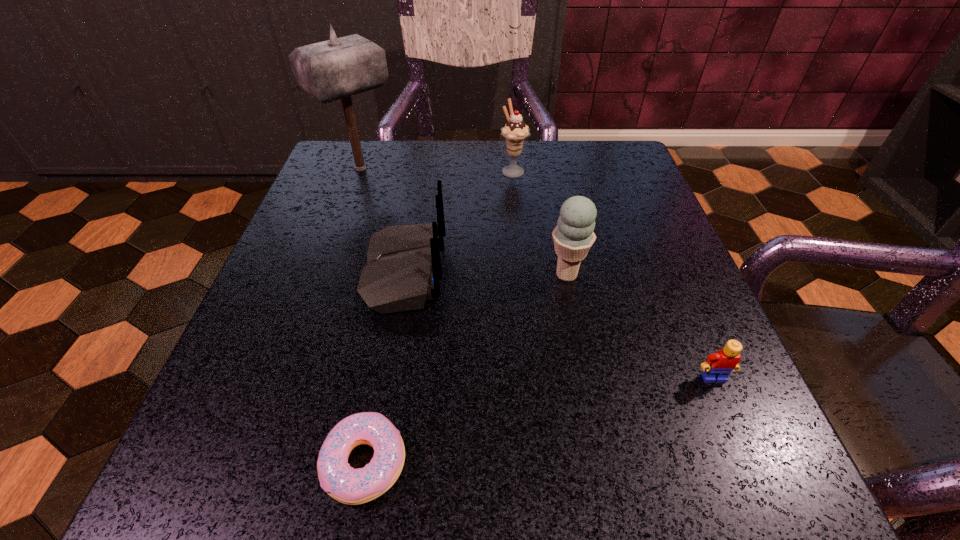
Where is `the tallest object`? This screenshot has height=540, width=960. the tallest object is located at coordinates (338, 68).

Where is `the farther ice cream`? This screenshot has width=960, height=540. the farther ice cream is located at coordinates (515, 132).

This screenshot has width=960, height=540. Identify the location of the left ice cream. (515, 132).

Where is `the right ice cream`? the right ice cream is located at coordinates (573, 236).

Find the location of `the nearer ice cream`. the nearer ice cream is located at coordinates pyautogui.click(x=573, y=236).

Identify the location of router. (403, 268).

You are a GUI agent. You are given a task and a screenshot of the screen. Output one action in this format:
    pyautogui.click(x=<x>, y=<y>)
    Task: Click on the Lego
    Image resolution: width=960 pixels, height=540 pixels.
    Given the screenshot: What is the action you would take?
    pyautogui.click(x=718, y=366)

At what (x,y) coordinates should I click in order to perform the action: click on the fifth farthest object. Please return your answer as a coordinate pair (x, y). Looking at the image, I should click on pyautogui.click(x=718, y=366).

Locate an element on the screen. doughnut is located at coordinates (345, 484).

Locate an element on the screen. The height and width of the screenshot is (540, 960). the shortest object is located at coordinates (345, 484).